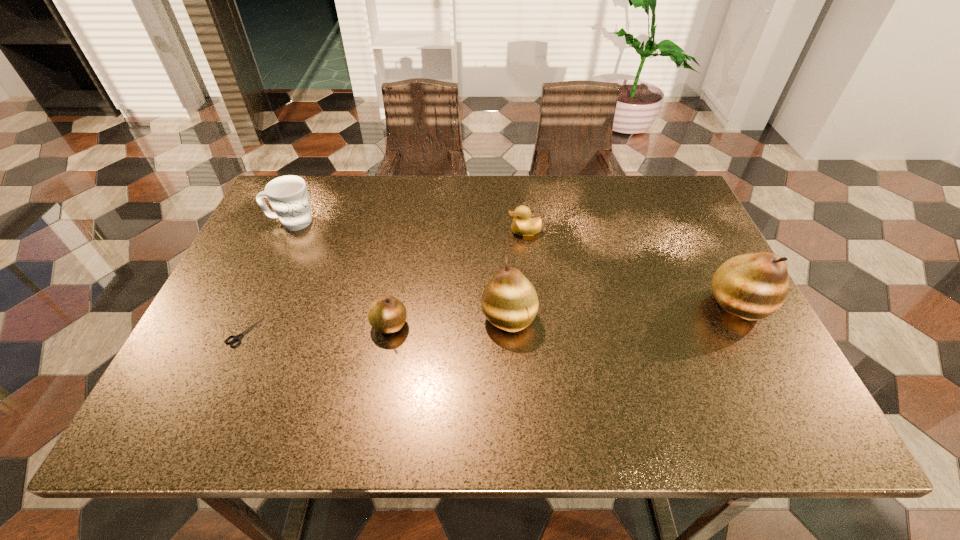
To make them evenly spaced by inserting another pear among them, please locate a free space for this new pear. Please provide its 2D coordinates. Your answer should be formatted as a tuple, i.e. [(x, y)], where the tuple contains the x and y coordinates of a point satisfying the conditions above.

[(625, 312)]